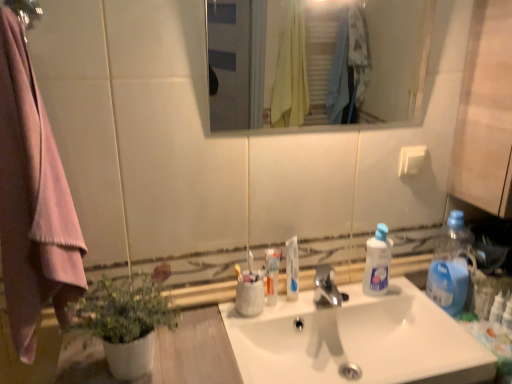
Question: Is white glossy toothpaste at center, which ranks as the second toothpaste in right-to-left order, in front of or behind blue plastic bottle at right, the 1th bottle viewed from the right, in the image?

Choices:
 (A) front
 (B) behind

Answer: (A)

Question: From a real-world perspective, is white glossy toothpaste at center, which ranks as the second toothpaste in right-to-left order, physically located above or below blue plastic bottle at right, acting as the 2th bottle starting from the left?

Choices:
 (A) below
 (B) above

Answer: (A)

Question: Based on their relative distances, which object is farther from the transparent plastic bottle at sink, marked as the 1th bottle in a left-to-right arrangement?

Choices:
 (A) matte black shower at upper left
 (B) green matte plant at lower left
 (C) clear glass mirror at upper center
 (D) white glossy toothpaste at center, which ranks as the second toothpaste in right-to-left order
 (E) satin nickel faucet at center

Answer: (C)

Question: Considering the real-world distances, which object is closest to the white glossy toothpaste at center, placed as the first toothpaste when sorted from right to left?

Choices:
 (A) green matte plant at lower left
 (B) white plastic toothbrush at center, marked as the 2th toothbrush in a left-to-right arrangement
 (C) white glossy sink at center
 (D) matte gray cup at center
 (E) clear glass mirror at upper center

Answer: (D)